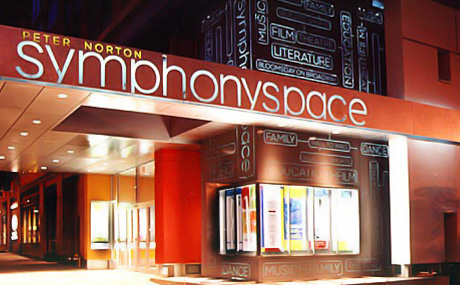
This screenshot has height=285, width=460. I want to click on window, so click(306, 212).